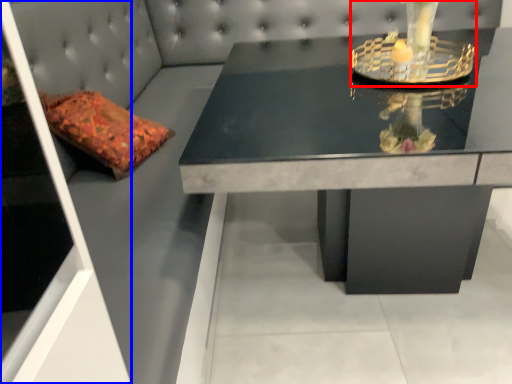
Question: Which object appears farthest to the camera in this image, candle holder (highlighted by a red box) or glass door (highlighted by a blue box)?

Choices:
 (A) candle holder
 (B) glass door

Answer: (A)